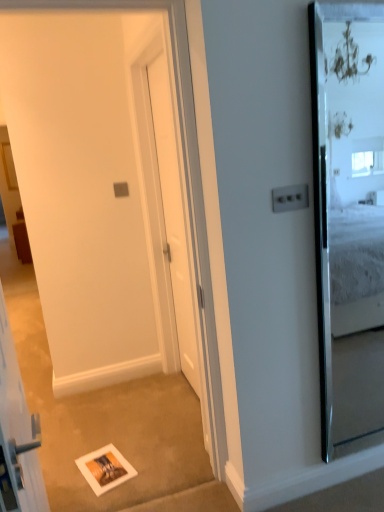
Question: Is white glossy elevator at lower left bigger or smaller than clear glass mirror at right?

Choices:
 (A) small
 (B) big

Answer: (B)

Question: From their relative heights in the image, would you say white glossy elevator at lower left is taller or shorter than clear glass mirror at right?

Choices:
 (A) tall
 (B) short

Answer: (B)

Question: Estimate the real-world distances between objects in this image. Which object is farther from the white glossy picture frame at lower center?

Choices:
 (A) white matte barn door at center
 (B) white glossy door at center
 (C) white glossy elevator at lower left
 (D) clear glass mirror at right

Answer: (D)

Question: Which of these objects is positioned farthest from the white glossy picture frame at lower center?

Choices:
 (A) white matte barn door at center
 (B) white glossy elevator at lower left
 (C) white glossy door at center
 (D) clear glass mirror at right

Answer: (D)